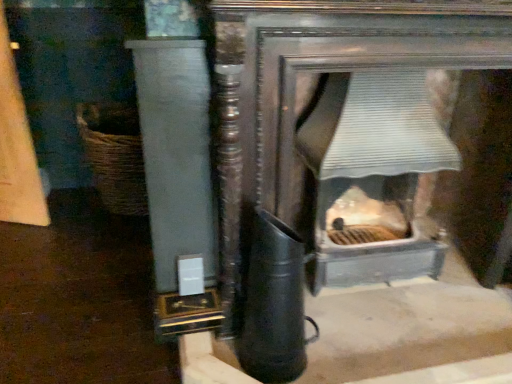
The image size is (512, 384). Identify the location of vacant space positioned to the left of white glossy pillar at left. (131, 338).